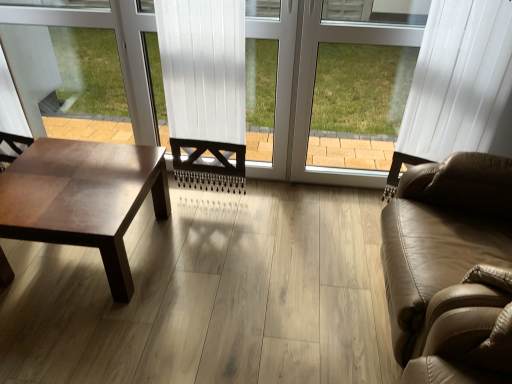
Question: Relative to tan leather couch at right, is shiny brown wood coffee table at left in front or behind?

Choices:
 (A) behind
 (B) front

Answer: (A)

Question: From the image's perspective, relative to tan leather couch at right, is shiny brown wood coffee table at left above or below?

Choices:
 (A) below
 (B) above

Answer: (B)

Question: Estimate the real-world distances between objects in this image. Which object is closer to the white plastic window frame at center?

Choices:
 (A) tan leather couch at right
 (B) shiny brown wood coffee table at left

Answer: (A)

Question: Based on their relative distances, which object is farther from the tan leather couch at right?

Choices:
 (A) shiny brown wood coffee table at left
 (B) white plastic window frame at center

Answer: (A)